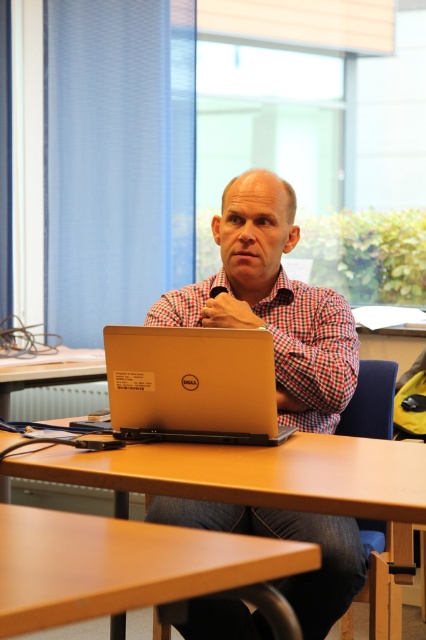
You are a delivery person who needs to place a small package that is 10 inches long on the brown wooden table at center without covering the silver metallic laptop at center. Is there enough space between them to place the package?

The brown wooden table at center and silver metallic laptop at center are 8.20 inches apart. Since the package is 10 inches long, it would not fit in the space between them without overlapping the laptop.

You are trying to place a new book that is 10 cm tall on the brown wooden table at center. The silver metallic laptop at center is currently occupying space on the table. Based on their heights, will the book fit on the table without being blocked by the laptop?

The brown wooden table at center is shorter than the silver metallic laptop at center. Since the table is shorter, placing the book on the table would mean the book could be blocked by the laptop if placed in front of it. However, the book is only 10 cm tall, so as long as it is placed beside the laptop where there is enough space, it should fit without being blocked by the laptop.